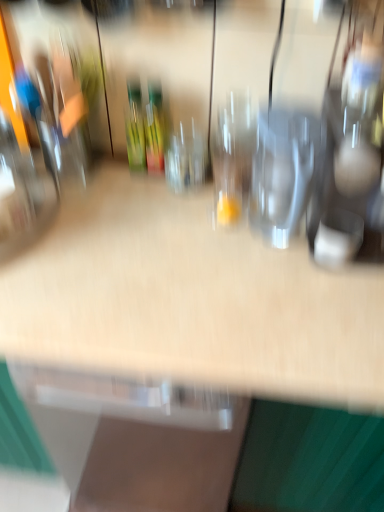
This screenshot has height=512, width=384. In order to click on free point to the left of transparent glass wine glass at center, which appears as the first wine glass when viewed from the left in this screenshot , I will do `click(122, 188)`.